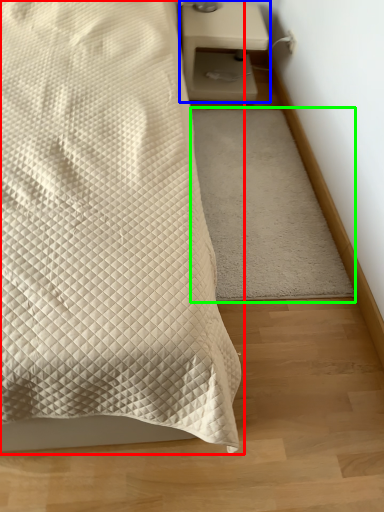
Question: Considering the real-world distances, which object is farthest from bed (highlighted by a red box)? nightstand (highlighted by a blue box) or mat (highlighted by a green box)?

Choices:
 (A) nightstand
 (B) mat

Answer: (A)